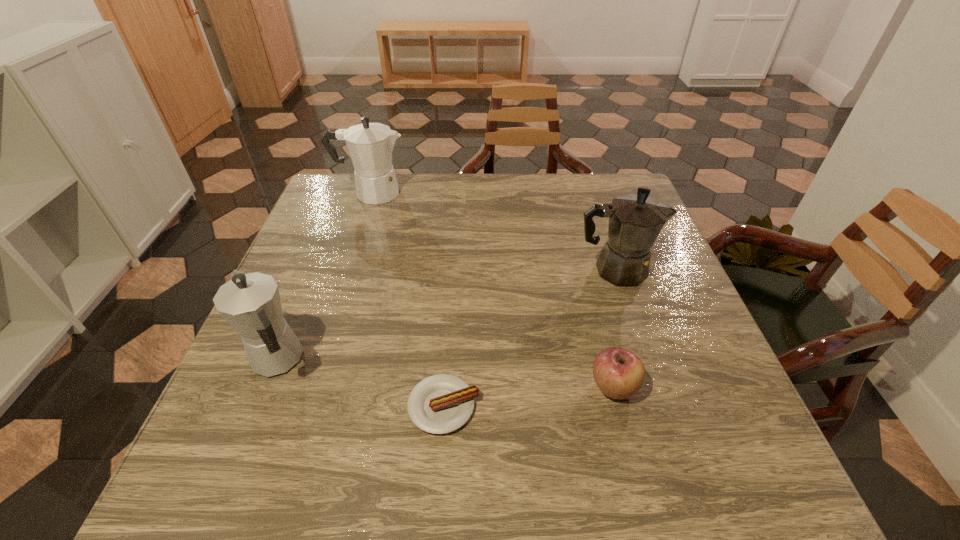
Identify the location of object that stands as the closest to the second farthest coffeepot. The image size is (960, 540). (619, 374).

Find the location of a particular element. The width and height of the screenshot is (960, 540). coffeepot that is the closest one to the shortest object is located at coordinates (250, 303).

Select which coffeepot appears as the closest to the shortest object. Please provide its 2D coordinates. Your answer should be formatted as a tuple, i.e. [(x, y)], where the tuple contains the x and y coordinates of a point satisfying the conditions above.

[(250, 303)]

Locate an element on the screen. free spot that satisfies the following two spatial constraints: 1. on the front side of the apple; 2. on the left side of the nearest coffeepot is located at coordinates (269, 387).

At what (x,y) coordinates should I click in order to perform the action: click on free space that satisfies the following two spatial constraints: 1. at the spout of the farthest coffeepot; 2. on the back side of the apple. Please return your answer as a coordinate pair (x, y). The width and height of the screenshot is (960, 540). Looking at the image, I should click on (306, 387).

Identify the location of vacant area in the image that satisfies the following two spatial constraints: 1. at the spout of the farthest coffeepot; 2. on the left side of the fourth tallest object. This screenshot has width=960, height=540. (306, 387).

At what (x,y) coordinates should I click in order to perform the action: click on vacant space that satisfies the following two spatial constraints: 1. at the spout of the farthest object; 2. on the right side of the shortest object. Please return your answer as a coordinate pair (x, y). The image size is (960, 540). Looking at the image, I should click on (300, 406).

Locate an element on the screen. Image resolution: width=960 pixels, height=540 pixels. free space that satisfies the following two spatial constraints: 1. at the spout of the farthest coffeepot; 2. on the front side of the nearest coffeepot is located at coordinates (316, 361).